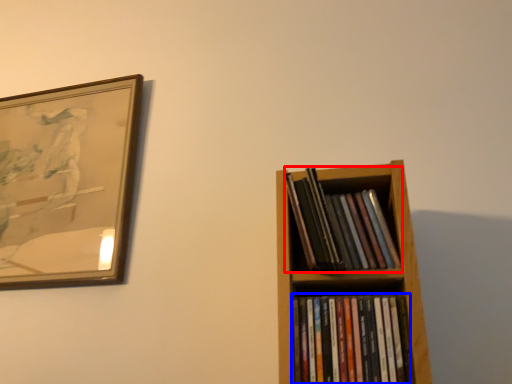
Question: Which object is closer to the camera taking this photo, book (highlighted by a red box) or book (highlighted by a blue box)?

Choices:
 (A) book
 (B) book

Answer: (B)